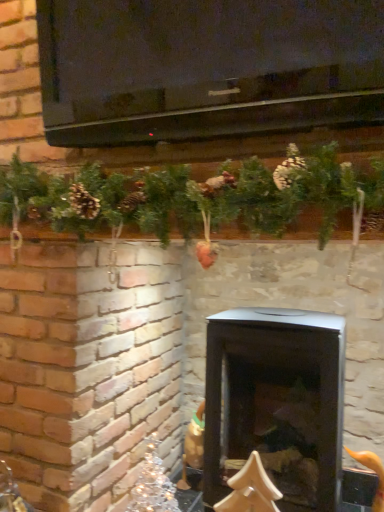
The height and width of the screenshot is (512, 384). What do you see at coordinates (276, 403) in the screenshot? I see `black matte wood burning stove at center` at bounding box center [276, 403].

Locate an element on the screen. This screenshot has height=512, width=384. black matte wood burning stove at center is located at coordinates tap(276, 403).

The width and height of the screenshot is (384, 512). Describe the element at coordinates (153, 483) in the screenshot. I see `iridescent glass ornament at lower left` at that location.

You are a GUI agent. You are given a task and a screenshot of the screen. Output one action in this format:
    pyautogui.click(x=<x>, y=<y>)
    Task: Click on the iridescent glass ornament at lower left
    
    Given the screenshot: What is the action you would take?
    pyautogui.click(x=153, y=483)

This screenshot has height=512, width=384. What are the coordinates of `black matte wood burning stove at center` in the screenshot? It's located at (276, 403).

Between iridescent glass ornament at lower left and black matte wood burning stove at center, which one appears on the left side from the viewer's perspective?

iridescent glass ornament at lower left is more to the left.

Which object is closer to the camera, iridescent glass ornament at lower left or black matte wood burning stove at center?

Positioned in front is black matte wood burning stove at center.

Which is farther, (151, 494) or (329, 457)?

The point (151, 494) is more distant.

From the image's perspective, which is below, iridescent glass ornament at lower left or black matte wood burning stove at center?

iridescent glass ornament at lower left is shown below in the image.

In the scene shown: From a real-world perspective, which is physically below, iridescent glass ornament at lower left or black matte wood burning stove at center?

From a 3D spatial view, iridescent glass ornament at lower left is below.

Between iridescent glass ornament at lower left and black matte wood burning stove at center, which one has smaller width?

Thinner between the two is iridescent glass ornament at lower left.

Between iridescent glass ornament at lower left and black matte wood burning stove at center, which one has more height?

Standing taller between the two is black matte wood burning stove at center.

Is iridescent glass ornament at lower left bigger than black matte wood burning stove at center?

Incorrect, iridescent glass ornament at lower left is not larger than black matte wood burning stove at center.

Is iridescent glass ornament at lower left situated inside black matte wood burning stove at center or outside?

iridescent glass ornament at lower left lies outside black matte wood burning stove at center.

Are iridescent glass ornament at lower left and black matte wood burning stove at center beside each other?

iridescent glass ornament at lower left and black matte wood burning stove at center are not in contact.

Is iridescent glass ornament at lower left oriented away from black matte wood burning stove at center?

iridescent glass ornament at lower left does not have its back to black matte wood burning stove at center.

How far apart are iridescent glass ornament at lower left and black matte wood burning stove at center?

iridescent glass ornament at lower left is 46.52 centimeters away from black matte wood burning stove at center.

What are the coordinates of `wood burning stove above the iridescent glass ornament at lower left (from a real-world perspective)` in the screenshot? It's located at (276, 403).

Is black matte wood burning stove at center at the left side of iridescent glass ornament at lower left?

In fact, black matte wood burning stove at center is to the right of iridescent glass ornament at lower left.

Who is more distant, black matte wood burning stove at center or iridescent glass ornament at lower left?

iridescent glass ornament at lower left is more distant.

Does point (297, 340) come farther from viewer compared to point (140, 503)?

No.

From the image's perspective, which is above, black matte wood burning stove at center or iridescent glass ornament at lower left?

black matte wood burning stove at center.

From a real-world perspective, does black matte wood burning stove at center stand above iridescent glass ornament at lower left?

Yes, from a real-world perspective, black matte wood burning stove at center is over iridescent glass ornament at lower left

Considering the sizes of black matte wood burning stove at center and iridescent glass ornament at lower left in the image, is black matte wood burning stove at center wider or thinner than iridescent glass ornament at lower left?

black matte wood burning stove at center is wider than iridescent glass ornament at lower left.

Between black matte wood burning stove at center and iridescent glass ornament at lower left, which one has more height?

black matte wood burning stove at center is taller.

Who is bigger, black matte wood burning stove at center or iridescent glass ornament at lower left?

black matte wood burning stove at center is bigger.

Can we say black matte wood burning stove at center lies outside iridescent glass ornament at lower left?

Yes, black matte wood burning stove at center is located beyond the bounds of iridescent glass ornament at lower left.

Is black matte wood burning stove at center touching iridescent glass ornament at lower left?

No, black matte wood burning stove at center is not beside iridescent glass ornament at lower left.

Is black matte wood burning stove at center facing away from iridescent glass ornament at lower left?

That's not correct — black matte wood burning stove at center is not looking away from iridescent glass ornament at lower left.

At what (x,y) coordinates should I click in order to perform the action: click on wood burning stove lying in front of the iridescent glass ornament at lower left. Please return your answer as a coordinate pair (x, y). Looking at the image, I should click on (276, 403).

You are a GUI agent. You are given a task and a screenshot of the screen. Output one action in this format:
    pyautogui.click(x=<x>, y=<y>)
    Task: Click on the christmas decoration below the black matte wood burning stove at center (from a real-world perspective)
    
    Given the screenshot: What is the action you would take?
    pyautogui.click(x=153, y=483)

Where is `wood burning stove in front of the iridescent glass ornament at lower left`? This screenshot has height=512, width=384. wood burning stove in front of the iridescent glass ornament at lower left is located at coordinates (276, 403).